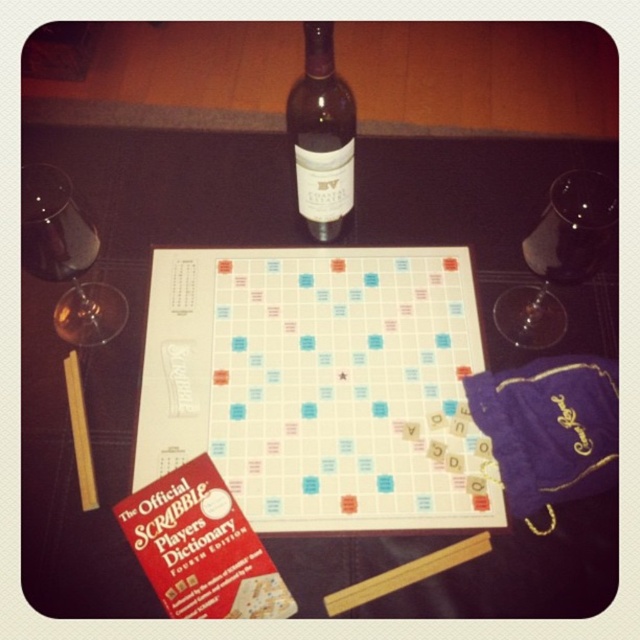
You are setting up a Scrabble game and need to place a 6 inch long ruler between the white plastic board at center and the transparent glass at upper right. Will the ruler fit in the space between them?

The distance between the white plastic board at center and the transparent glass at upper right is 5.90 inches, which is slightly shorter than the ruler. The ruler will not fit in the space between them.

You are playing Scrabble and need to place your tiles on the board. The board has a specific center marked with a star. Where is the point with coordinates point (124, 333) located on the board?

The point (124, 333) is on the white matte board game at center, so it is located at the center of the board marked with a star.